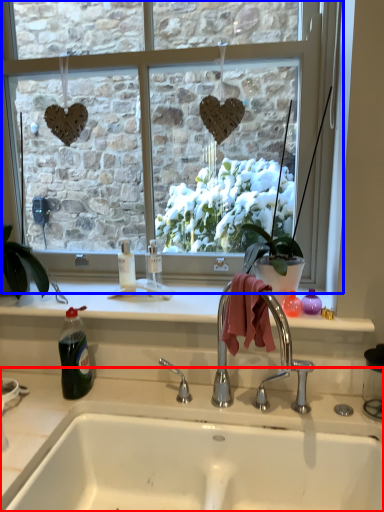
Question: Among these objects, which one is nearest to the camera, countertop (highlighted by a red box) or window (highlighted by a blue box)?

Choices:
 (A) countertop
 (B) window

Answer: (A)